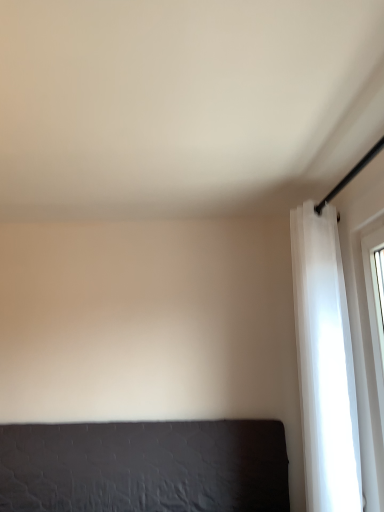
Question: Considering the positions of dark gray fabric bed at lower left and white sheer curtain at right in the image, is dark gray fabric bed at lower left wider or thinner than white sheer curtain at right?

Choices:
 (A) thin
 (B) wide

Answer: (A)

Question: From the image's perspective, is dark gray fabric bed at lower left positioned above or below white sheer curtain at right?

Choices:
 (A) below
 (B) above

Answer: (A)

Question: From their relative heights in the image, would you say dark gray fabric bed at lower left is taller or shorter than white sheer curtain at right?

Choices:
 (A) short
 (B) tall

Answer: (A)

Question: Is white sheer curtain at right wider or thinner than dark gray fabric bed at lower left?

Choices:
 (A) thin
 (B) wide

Answer: (B)

Question: In terms of height, does white sheer curtain at right look taller or shorter compared to dark gray fabric bed at lower left?

Choices:
 (A) tall
 (B) short

Answer: (A)

Question: Based on their positions, is white sheer curtain at right located to the left or right of dark gray fabric bed at lower left?

Choices:
 (A) left
 (B) right

Answer: (B)

Question: In terms of size, does white sheer curtain at right appear bigger or smaller than dark gray fabric bed at lower left?

Choices:
 (A) small
 (B) big

Answer: (B)